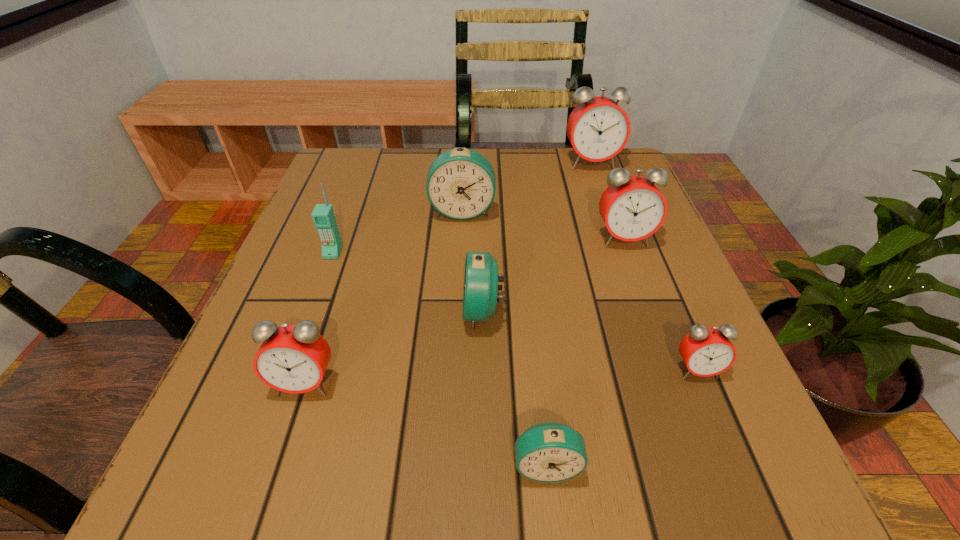
Identify the location of the second smallest red alarm clock. (292, 358).

This screenshot has width=960, height=540. Find the location of `the smallest red alarm clock`. the smallest red alarm clock is located at coordinates (706, 351).

You are a GUI agent. You are given a task and a screenshot of the screen. Output one action in this format:
    pyautogui.click(x=<x>, y=<y>)
    Task: Click on the fifth object from left to right
    The height and width of the screenshot is (540, 960).
    Given the screenshot: What is the action you would take?
    pyautogui.click(x=550, y=452)

At what (x,y) coordinates should I click in order to perform the action: click on the nearest alarm clock. Please return your answer as a coordinate pair (x, y). Looking at the image, I should click on [550, 452].

Find the location of a particular element. The image size is (960, 540). vacant space located on the front-facing side of the farthest red alarm clock is located at coordinates (612, 223).

This screenshot has height=540, width=960. Find the location of `free space located 0.140m on the front-facing side of the farthest blue alarm clock`. free space located 0.140m on the front-facing side of the farthest blue alarm clock is located at coordinates (460, 269).

What are the coordinates of `free region located on the front-facing side of the fifth nearest alarm clock` in the screenshot? It's located at (635, 268).

You are a GUI agent. You are given a task and a screenshot of the screen. Output one action in this format:
    pyautogui.click(x=<x>, y=<y>)
    Task: Click on the vacant space located on the keypad of the cellular telephone
    This screenshot has height=540, width=960.
    Given the screenshot: What is the action you would take?
    pyautogui.click(x=292, y=367)

Where is `free region located on the front-facing side of the fourth farthest alarm clock`? free region located on the front-facing side of the fourth farthest alarm clock is located at coordinates (415, 311).

Locate an element on the screen. free space located 0.060m on the front-facing side of the fourth farthest alarm clock is located at coordinates (426, 311).